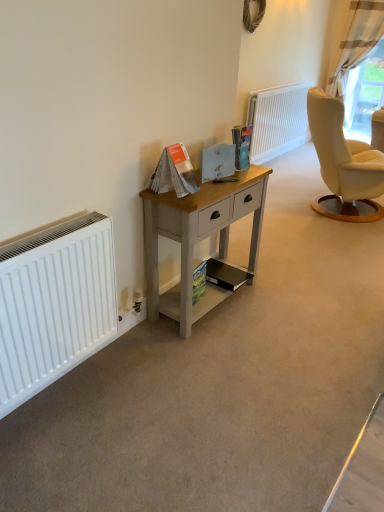
This screenshot has width=384, height=512. What are the coordinates of `empty space that is to the right of matte paper magazine at center, marked as the 3th magazine in a bottom-to-top arrangement` in the screenshot? It's located at (210, 193).